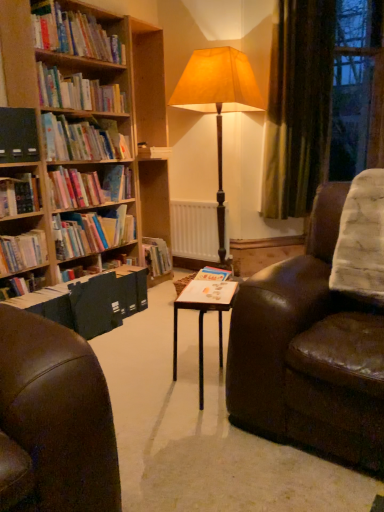
Question: Would you say hardcover books at upper left, which is counted as the 7th book, starting from the bottom, contains hardcover book at upper left, placed as the third book when sorted from top to bottom?

Choices:
 (A) no
 (B) yes

Answer: (A)

Question: Does hardcover books at upper left, which is counted as the 7th book, starting from the bottom, have a larger size compared to hardcover book at upper left, placed as the third book when sorted from top to bottom?

Choices:
 (A) yes
 (B) no

Answer: (B)

Question: From the image's perspective, is hardcover books at upper left, which is counted as the 7th book, starting from the bottom, beneath hardcover book at upper left, which ranks as the 5th book in bottom-to-top order?

Choices:
 (A) yes
 (B) no

Answer: (B)

Question: Is hardcover books at upper left, which is counted as the 7th book, starting from the bottom, closer to the viewer compared to hardcover book at upper left, which ranks as the 5th book in bottom-to-top order?

Choices:
 (A) no
 (B) yes

Answer: (B)

Question: Is hardcover books at upper left, positioned as the 1th book in top-to-bottom order, behind hardcover book at upper left, placed as the third book when sorted from top to bottom?

Choices:
 (A) no
 (B) yes

Answer: (A)

Question: From a real-world perspective, relative to wooden floor lamp at center, is hardcover book at left, which is the 1th book from bottom to top, vertically above or below?

Choices:
 (A) below
 (B) above

Answer: (A)

Question: Based on their positions, is hardcover book at left, acting as the 7th book starting from the top, located to the left or right of wooden floor lamp at center?

Choices:
 (A) left
 (B) right

Answer: (A)

Question: Considering the positions of point (33, 230) and point (231, 71), is point (33, 230) closer or farther from the camera than point (231, 71)?

Choices:
 (A) farther
 (B) closer

Answer: (B)

Question: Considering the positions of hardcover book at left, acting as the 7th book starting from the top, and wooden floor lamp at center in the image, is hardcover book at left, acting as the 7th book starting from the top, bigger or smaller than wooden floor lamp at center?

Choices:
 (A) small
 (B) big

Answer: (A)

Question: Is point (72, 26) positioned closer to the camera than point (6, 159)?

Choices:
 (A) closer
 (B) farther

Answer: (B)

Question: Would you say hardcover books at upper left, positioned as the 1th book in top-to-bottom order, is inside or outside black matte book at left, which ranks as the first paperback book in left-to-right order?

Choices:
 (A) outside
 (B) inside

Answer: (A)

Question: Is hardcover books at upper left, which is counted as the 7th book, starting from the bottom, in front of or behind black matte book at left, the 1th paperback book in the top-to-bottom sequence, in the image?

Choices:
 (A) front
 (B) behind

Answer: (B)

Question: Looking at the image, does hardcover books at upper left, which is counted as the 7th book, starting from the bottom, seem bigger or smaller compared to black matte book at left, positioned as the 2th paperback book in right-to-left order?

Choices:
 (A) big
 (B) small

Answer: (A)

Question: Relative to black matte book at left, which ranks as the first paperback book in back-to-front order, is dark green velvet curtain at upper right in front or behind?

Choices:
 (A) front
 (B) behind

Answer: (B)

Question: From the image's perspective, is dark green velvet curtain at upper right positioned above or below black matte book at left, positioned as the 2th paperback book in right-to-left order?

Choices:
 (A) above
 (B) below

Answer: (A)